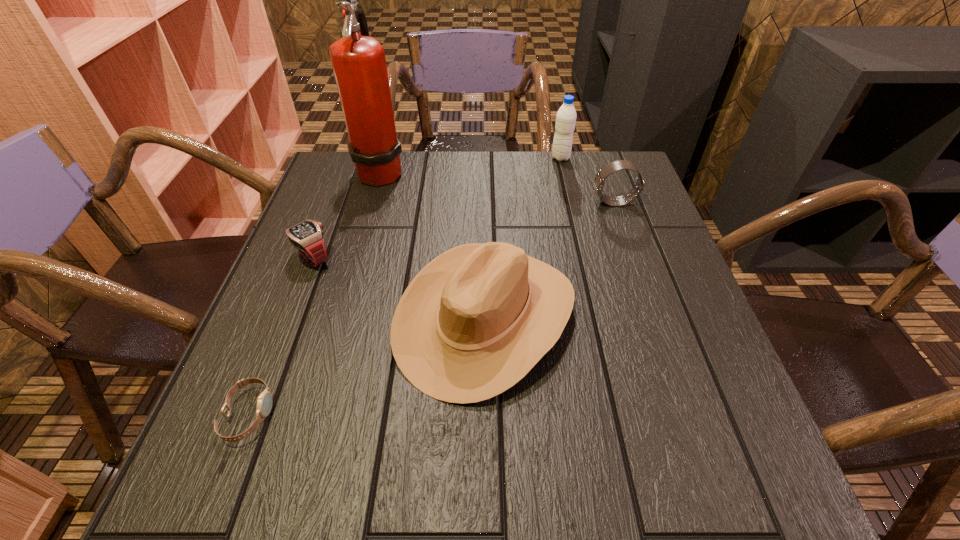
Find the location of a particular element. the nearest watch is located at coordinates (264, 404).

The width and height of the screenshot is (960, 540). Find the location of `vacant area situated 0.240m at the nozzle of the fire extinguisher`. vacant area situated 0.240m at the nozzle of the fire extinguisher is located at coordinates (492, 171).

The image size is (960, 540). I want to click on vacant space located 0.190m on the front of the water bottle, so click(x=571, y=203).

Locate an element on the screen. blank space located 0.160m on the front of the fourth object from left to right is located at coordinates (488, 510).

You are a GUI agent. You are given a task and a screenshot of the screen. Output one action in this format:
    pyautogui.click(x=<x>, y=<y>)
    Task: Click on the vacant space located 0.220m on the face of the fourth tallest object
    
    Given the screenshot: What is the action you would take?
    pyautogui.click(x=507, y=202)

Locate an element on the screen. The height and width of the screenshot is (540, 960). blank space located on the face of the fourth tallest object is located at coordinates (480, 202).

The height and width of the screenshot is (540, 960). I want to click on vacant area situated on the face of the fourth tallest object, so pos(507,202).

Locate an element on the screen. This screenshot has width=960, height=540. vacant space located 0.150m on the back of the second farthest watch is located at coordinates (333, 205).

Identify the location of free space located on the face of the shortest object. Image resolution: width=960 pixels, height=540 pixels. (451, 415).

This screenshot has width=960, height=540. Identify the location of fire extinguisher that is at the far edge. (359, 64).